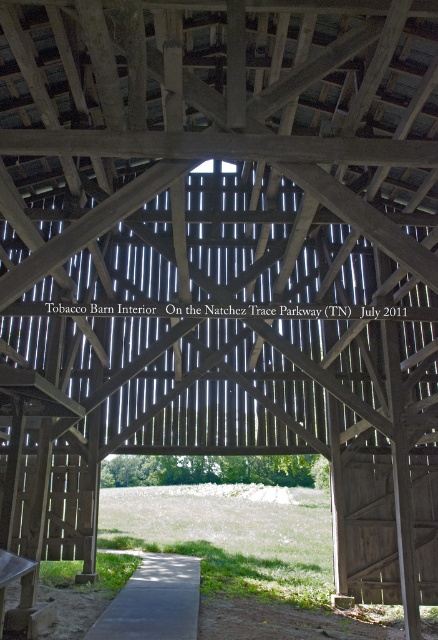
Question: Which of the following is the closest to the observer?

Choices:
 (A) gray concrete path at center
 (B) wooden picnic table at lower left

Answer: (B)

Question: Is gray concrete path at center wider than wooden picnic table at lower left?

Choices:
 (A) no
 (B) yes

Answer: (A)

Question: Is gray concrete path at center wider than wooden picnic table at lower left?

Choices:
 (A) yes
 (B) no

Answer: (B)

Question: Can you confirm if gray concrete path at center is positioned below wooden picnic table at lower left?

Choices:
 (A) no
 (B) yes

Answer: (B)